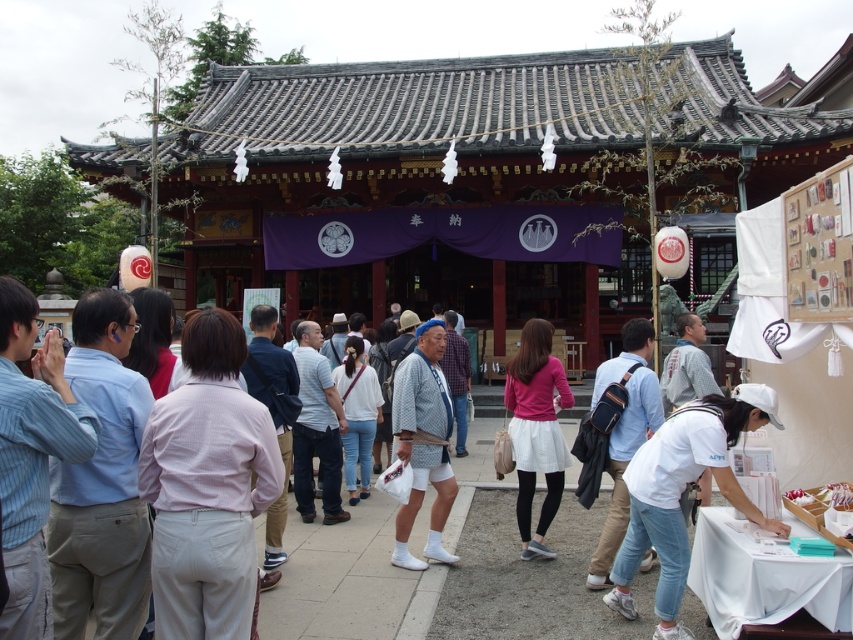
You are standing at the shrine entrance and want to take a photo of the purple banner hanging across the entrance. The banner is located at point (245, 397). You have a camera with a focal length of 50mm. What is the angle of view required to capture the entire banner in the photo?

The distance between the viewer and point (245, 397) is 5.99 meters. To calculate the angle of view needed to capture the entire banner, you would need to know the banner dimensions and use the formula angle of view arctangent. However, since the banner dimensions are not provided, it is impossible to determine the exact angle of view required.

In the scene shown: You are standing at the entrance of the shrine and want to locate the light blue shirt at left. Which direction should you look to find it?

The light blue shirt at left is located at point 0.756 on the x axis and 0.120 on the y axis. Since the x coordinate is 0.756, which is to the right side of the image, you should look to your right to find it.